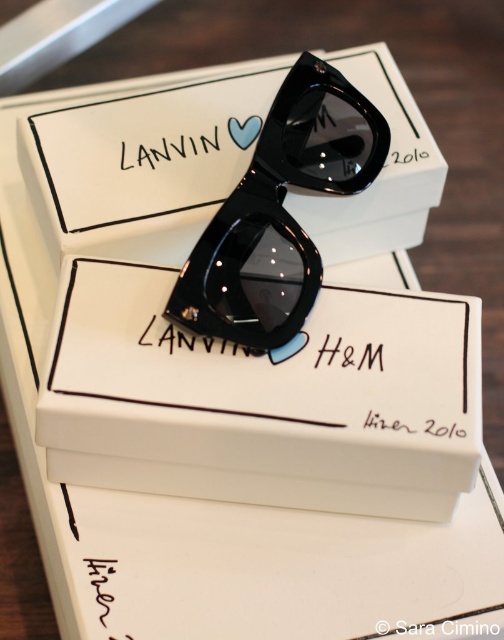
You are organizing a display and need to ensure the boxes are stable. Given that the white cardboard box at center is taller than the white cardboard box at upper center, which box should you place at the bottom to ensure stability?

To ensure stability, you should place the taller white cardboard box at center at the bottom since it has a greater height and a wider base compared to the white cardboard box at upper center.

You are a delivery person who needs to place a new package on the table where the white cardboard box at center and glossy black sunglasses at center are already present. The new package is 3 inches thick. Can you place it between the two items without moving them?

The distance between the white cardboard box at center and the glossy black sunglasses at center is 7.55 inches. Since the new package is 3 inches thick, there is enough space between them to place it without moving the existing items.

Based on the photo, you are a delivery person who needs to place a new pair of sunglasses on the table where the white cardboard box at upper center and glossy black sunglasses at center are already present. Where should you place the new sunglasses to ensure they are visible and not hidden by the existing items?

Place the new sunglasses next to the glossy black sunglasses at center since the white cardboard box at upper center is larger and might block the view if placed underneath it.